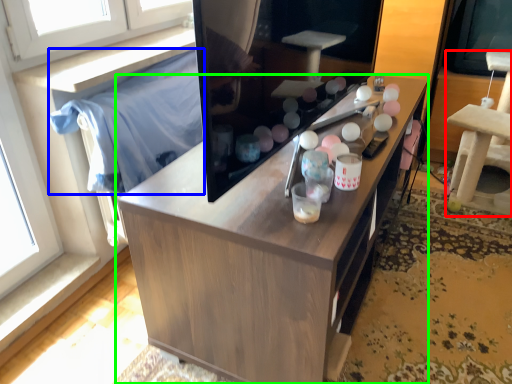
Question: Which object is positioned closest to furniture (highlighted by a red box)? Select from cloth (highlighted by a blue box) and cabinetry (highlighted by a green box).

Choices:
 (A) cloth
 (B) cabinetry

Answer: (B)